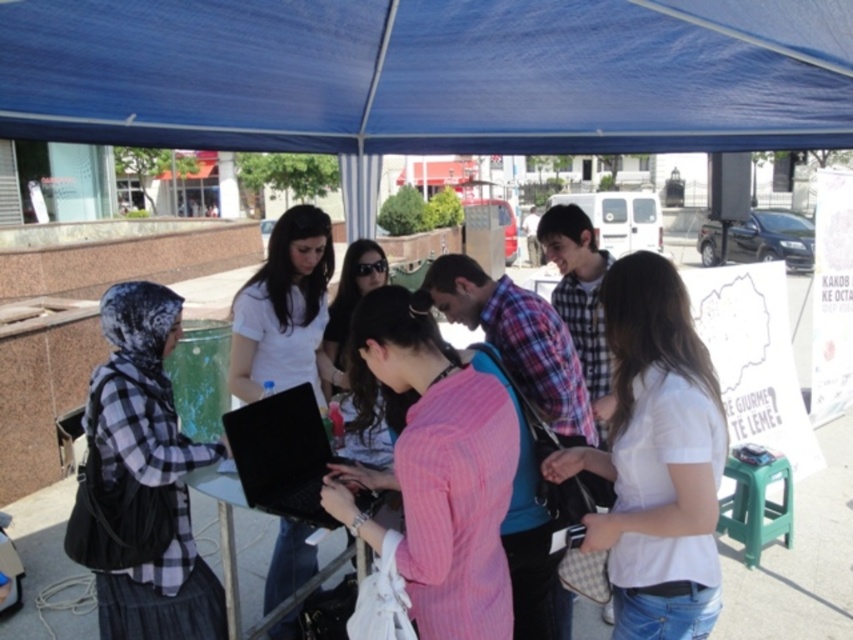
You are standing facing the plaid fabric shirt at left and the metallic silver table at center. Which object is closer to your left side?

The plaid fabric shirt at left is closer to your left side since it is positioned to the left of the metallic silver table at center.

You are a photographer standing 10 inches away from the plaid fabric shirt at left. You want to take a photo of the metallic silver table at center. Can you reach the table without moving closer to it?

The distance between the plaid fabric shirt at left and the metallic silver table at center is 12.63 inches. Since you are already 10 inches away from the plaid fabric shirt at left, you are 2.63 inches away from the table. Therefore, you can take the photo without moving closer.

You are a person who wants to sit on the green plastic stool at lower right to use the black matte laptop at center. Is the laptop within easy reach from the stool?

The black matte laptop at center is located above the green plastic stool at lower right, so it should be within easy reach while sitting on the stool.